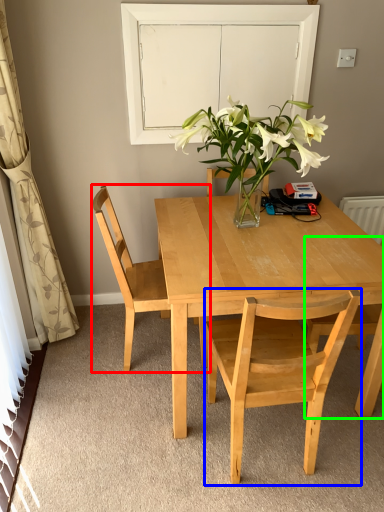
Question: Which object is positioned farthest from chair (highlighted by a red box)? Select from chair (highlighted by a blue box) and chair (highlighted by a green box).

Choices:
 (A) chair
 (B) chair

Answer: (B)